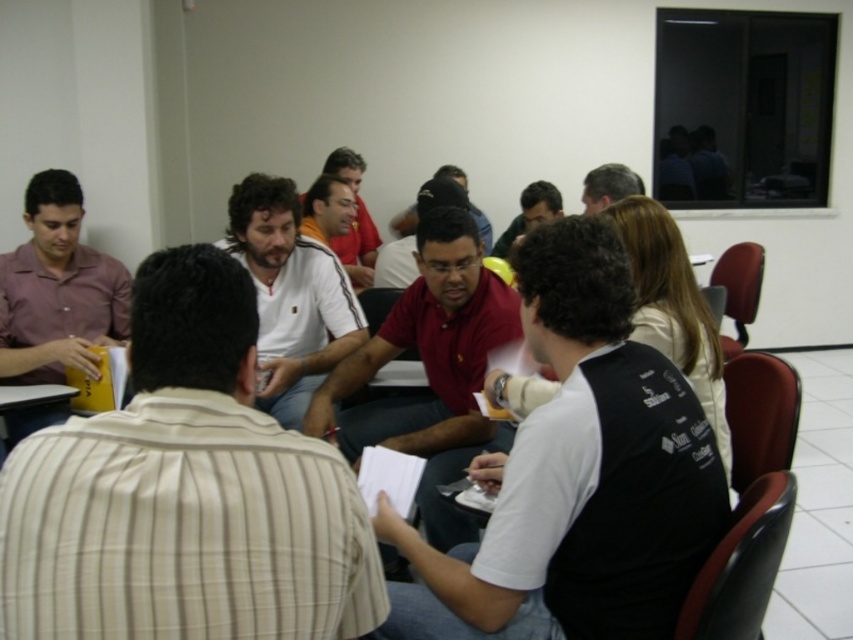
Is matte pink shirt at left behind white cotton shirt at center?

No, it is in front of white cotton shirt at center.

Does matte pink shirt at left have a larger size compared to white cotton shirt at center?

Answer: Actually, matte pink shirt at left might be smaller than white cotton shirt at center.

Identify the location of matte pink shirt at left. This screenshot has height=640, width=853. (57, 291).

Can you confirm if matte pink shirt at left is thinner than matte black shirt at center?

No, matte pink shirt at left is not thinner than matte black shirt at center.

Locate an element on the screen. The height and width of the screenshot is (640, 853). matte pink shirt at left is located at coordinates (57, 291).

Is striped cotton shirt at left above white cotton shirt at center?

No, striped cotton shirt at left is not above white cotton shirt at center.

Is point (265, 605) positioned before point (368, 227)?

Yes.

Identify the location of striped cotton shirt at left. The height and width of the screenshot is (640, 853). [x=184, y=492].